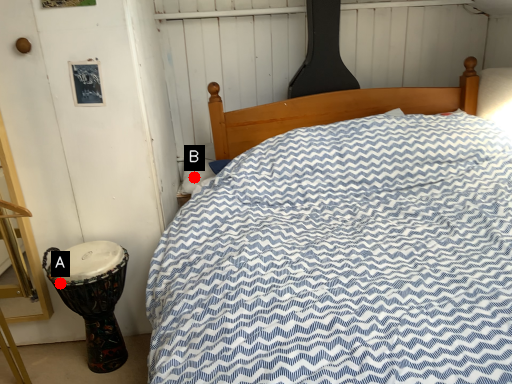
Question: Two points are circled on the image, labeled by A and B beside each circle. Among these points, which one is farthest from the camera?

Choices:
 (A) A is further
 (B) B is further

Answer: (B)